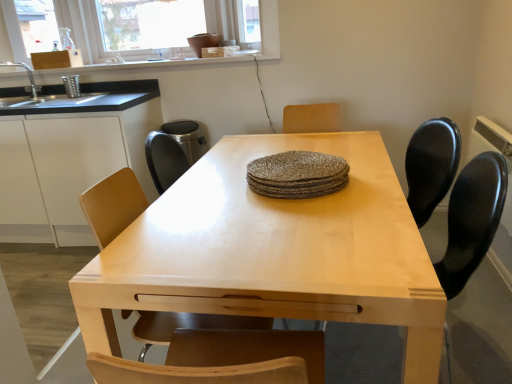
The height and width of the screenshot is (384, 512). What are the coordinates of `vacant space situated above light wood table at center (from a real-world perspective)` in the screenshot? It's located at pos(265,206).